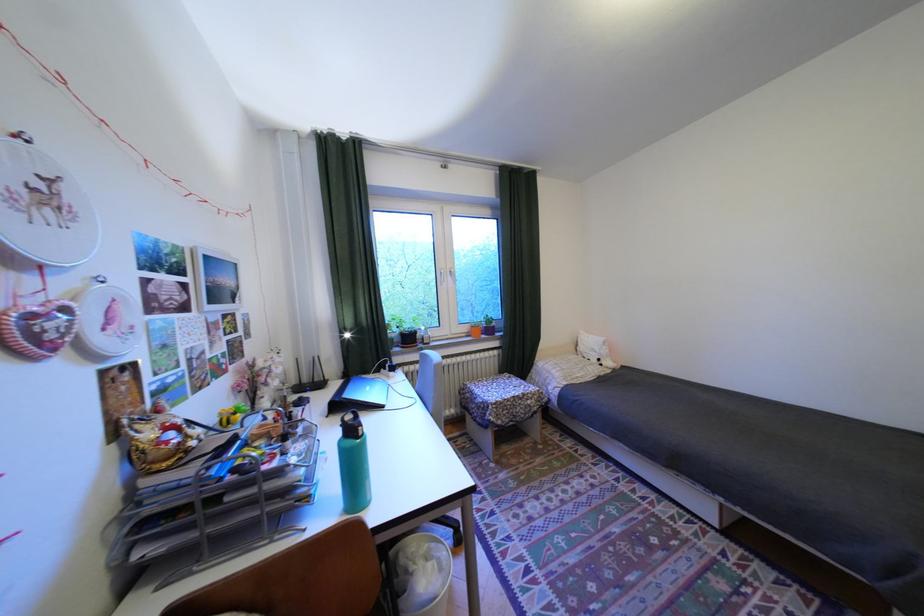
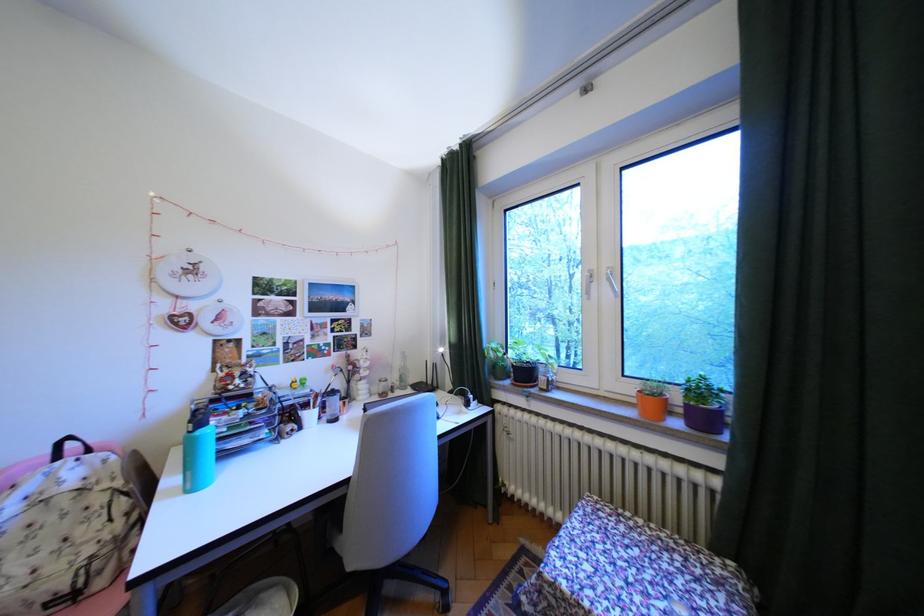
The point at (502, 321) is marked in the first image. Where is the corresponding point in the second image?

(710, 391)